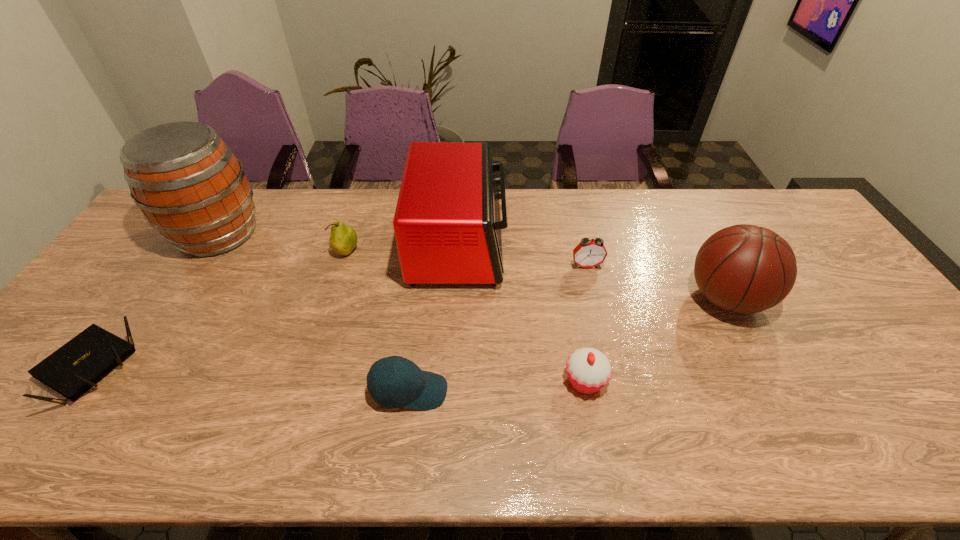
At what (x,y) coordinates should I click in order to perform the action: click on object identified as the fifth closest to the alarm clock. Please return your answer as a coordinate pair (x, y). The width and height of the screenshot is (960, 540). Looking at the image, I should click on (343, 239).

Where is `vacant space that satisfies the following two spatial constraints: 1. on the clock face of the basketball; 2. on the left side of the alarm clock`? vacant space that satisfies the following two spatial constraints: 1. on the clock face of the basketball; 2. on the left side of the alarm clock is located at coordinates (594, 298).

This screenshot has height=540, width=960. I want to click on vacant space that satisfies the following two spatial constraints: 1. on the front side of the cupcake; 2. on the right side of the pear, so click(x=307, y=381).

You are a GUI agent. You are given a task and a screenshot of the screen. Output one action in this format:
    pyautogui.click(x=<x>, y=<y>)
    Task: Click on the free space that satisfies the following two spatial constraints: 1. on the front side of the basketball; 2. on the left side of the third object from left to right
    The image size is (960, 540).
    Given the screenshot: What is the action you would take?
    pyautogui.click(x=332, y=298)